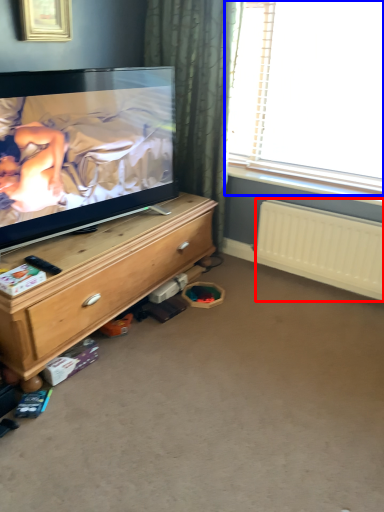
Question: Which point is further to the camera, radiator (highlighted by a red box) or window (highlighted by a blue box)?

Choices:
 (A) radiator
 (B) window

Answer: (A)